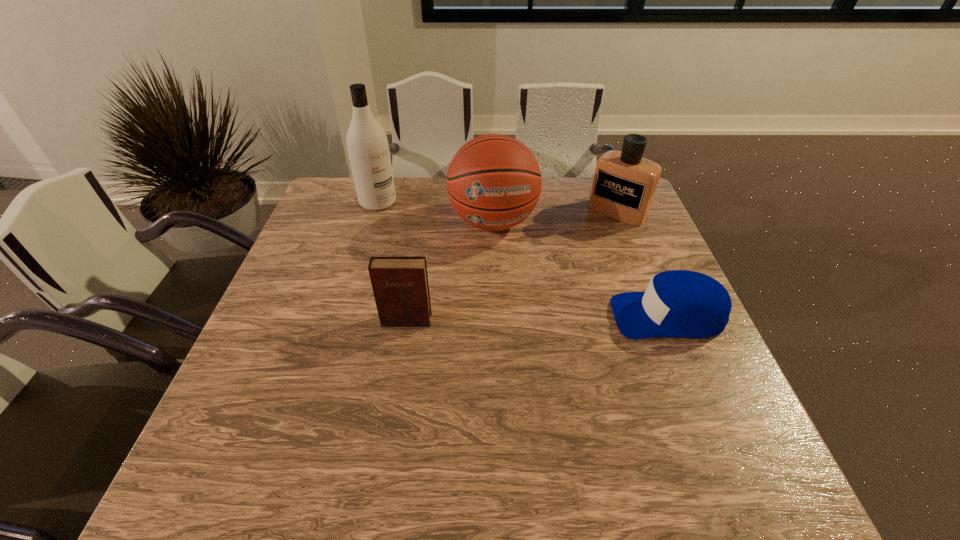
What are the coordinates of `vacant spot on the desktop that is between the second object from left to right and the baseball cap and is positioned on the logo side of the basketball` in the screenshot? It's located at (510, 319).

The height and width of the screenshot is (540, 960). In order to click on free space on the desktop that is between the fourth tallest object and the baseball cap and is positioned on the front label of the perfume in this screenshot , I will do `click(516, 319)`.

Find the location of `free spot on the desktop that is between the second object from left to right and the baseball cap and is positioned on the front-facing side of the leftmost object`. free spot on the desktop that is between the second object from left to right and the baseball cap and is positioned on the front-facing side of the leftmost object is located at coordinates (522, 319).